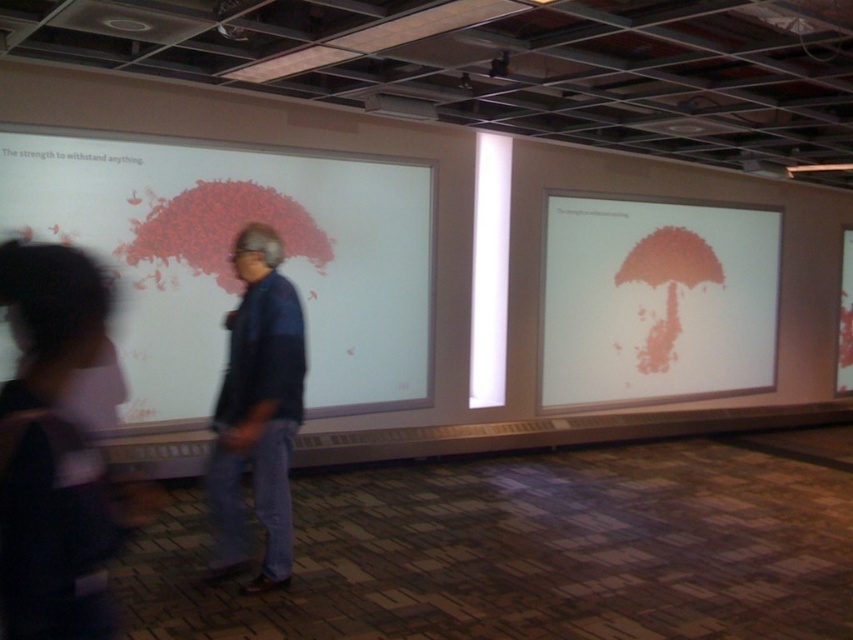
Does matte white board at upper left have a greater height compared to matte red umbrella at center right?

Incorrect, matte white board at upper left's height is not larger of matte red umbrella at center right's.

This screenshot has height=640, width=853. I want to click on matte white board at upper left, so [228, 259].

Is point (323, 372) positioned after point (664, 262)?

No, (323, 372) is closer to viewer.

Identify the location of matte white board at upper left. (228, 259).

Between matte red umbrella at center right and dark blue jeans at center, which one appears on the right side from the viewer's perspective?

matte red umbrella at center right

Can you confirm if matte red umbrella at center right is positioned to the left of dark blue jeans at center?

In fact, matte red umbrella at center right is to the right of dark blue jeans at center.

This screenshot has height=640, width=853. Describe the element at coordinates (656, 300) in the screenshot. I see `matte red umbrella at center right` at that location.

I want to click on matte red umbrella at center right, so click(x=656, y=300).

Which is behind, point (682, 305) or point (241, 557)?

Positioned behind is point (682, 305).

Between matte red umbrella at center right and denim jacket at center, which one appears on the right side from the viewer's perspective?

matte red umbrella at center right

Which is behind, point (561, 252) or point (241, 520)?

Positioned behind is point (561, 252).

Locate an element on the screen. The height and width of the screenshot is (640, 853). matte red umbrella at center right is located at coordinates click(x=656, y=300).